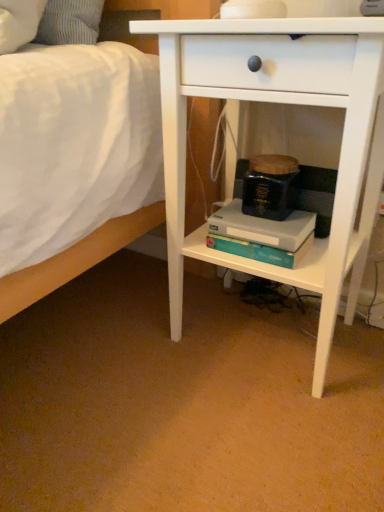
Where is `free spot below white matte nightstand at center (from a real-world perspective)`? This screenshot has height=512, width=384. free spot below white matte nightstand at center (from a real-world perspective) is located at coordinates point(254,335).